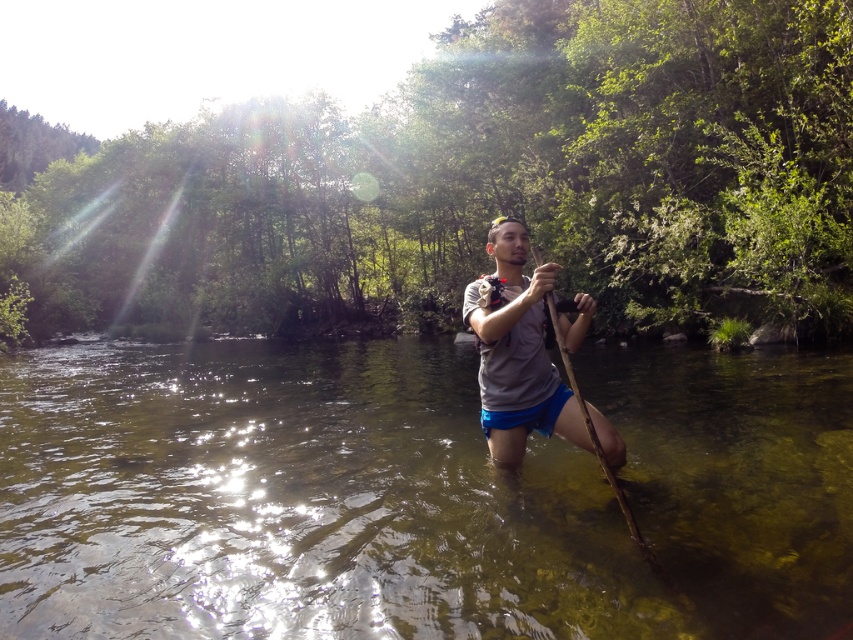
Question: Is gray matte shirt at center bigger than brown wooden paddle at center?

Choices:
 (A) no
 (B) yes

Answer: (B)

Question: Is gray matte shirt at center below brown wooden paddle at center?

Choices:
 (A) no
 (B) yes

Answer: (A)

Question: Which object is positioned farthest from the brown wooden paddle at center?

Choices:
 (A) clear water at center
 (B) gray matte shirt at center

Answer: (A)

Question: Is gray matte shirt at center positioned behind brown wooden paddle at center?

Choices:
 (A) yes
 (B) no

Answer: (B)

Question: Which object appears farthest from the camera in this image?

Choices:
 (A) brown wooden paddle at center
 (B) gray matte shirt at center

Answer: (A)

Question: Which of the following is the closest to the observer?

Choices:
 (A) (566, 426)
 (B) (549, 310)
 (C) (399, 618)

Answer: (C)